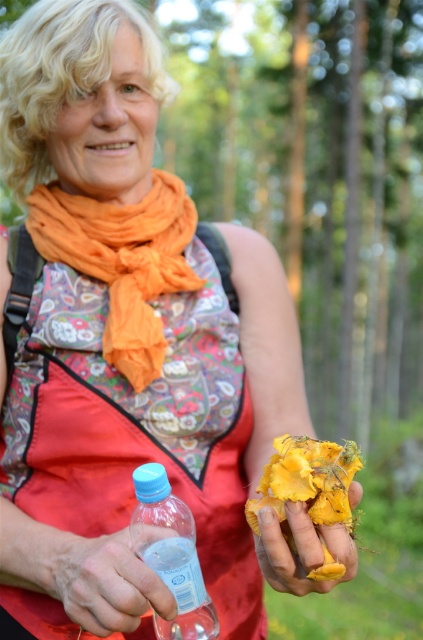
Question: Which point is closer to the camera?

Choices:
 (A) yellow matte mushroom at center
 (B) yellow matte flower at center

Answer: (B)

Question: Is orange silk scarf at upper center above transparent plastic bottle at lower left?

Choices:
 (A) yes
 (B) no

Answer: (A)

Question: Which point is farther to the camera?

Choices:
 (A) yellow matte flower at center
 (B) transparent plastic bottle at lower left
 (C) yellow matte mushroom at center
 (D) orange silk scarf at upper center

Answer: (D)

Question: Among these points, which one is farthest from the camera?

Choices:
 (A) (57, 506)
 (B) (142, 509)
 (C) (320, 545)

Answer: (A)

Question: Where is translucent plastic bottle at lower left located in relation to yellow matte mushroom at center in the image?

Choices:
 (A) below
 (B) above

Answer: (A)

Question: Is translucent plastic bottle at lower left thinner than yellow matte mushroom at center?

Choices:
 (A) yes
 (B) no

Answer: (B)